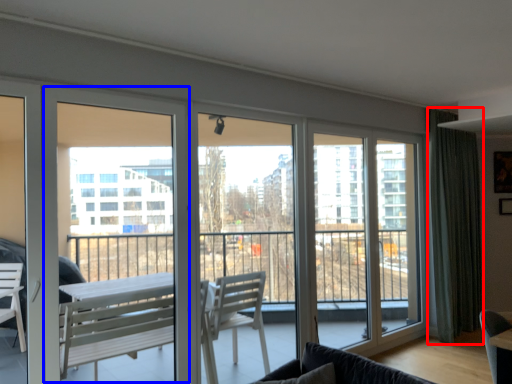
Question: Among these objects, which one is nearest to the camera, curtain (highlighted by a red box) or screen door (highlighted by a blue box)?

Choices:
 (A) curtain
 (B) screen door

Answer: (B)